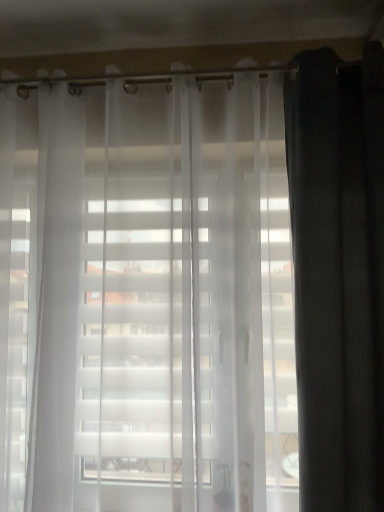
Question: Should I look upward or downward to see dark matte curtain at right?

Choices:
 (A) up
 (B) down

Answer: (B)